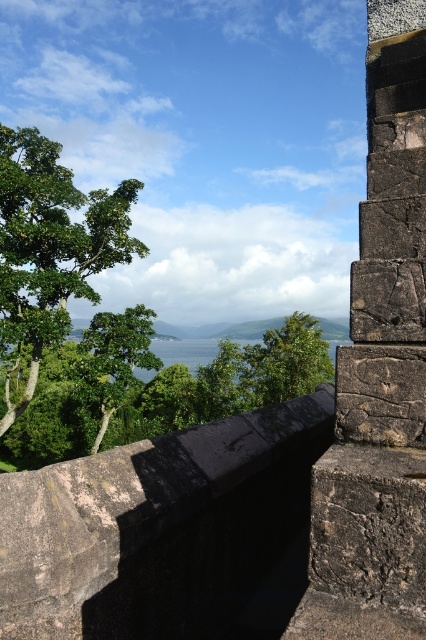
You are an architect designing a new garden and want to incorporate two green leafy trees similar to those in the image. Which of the two trees, the green leafy tree at left or the green leafy tree at center, should you choose if you want a larger tree for the garden entrance?

The green leafy tree at left is larger in size than the green leafy tree at center, so you should choose the green leafy tree at left for the garden entrance.

You are a drone operator tasked with flying a drone from the dark stone ledge at upper center to the green leafy tree at center. The drone has a maximum flight range of 35 meters. Based on the scene, can the drone successfully reach the tree?

The distance between the dark stone ledge at upper center and the green leafy tree at center is 37.08 meters, which exceeds the drone maximum flight range of 35 meters. Therefore, the drone cannot successfully reach the tree.

You are an architect designing a new garden and want to place a small bench. You have two options for locations based on the image. The first is near the dark stone ledge at upper center, and the second is near the green leafy tree at center. Which location has more space for the bench?

The green leafy tree at center occupies more space than the dark stone ledge at upper center, so the location near the green leafy tree at center would provide more space for the bench.